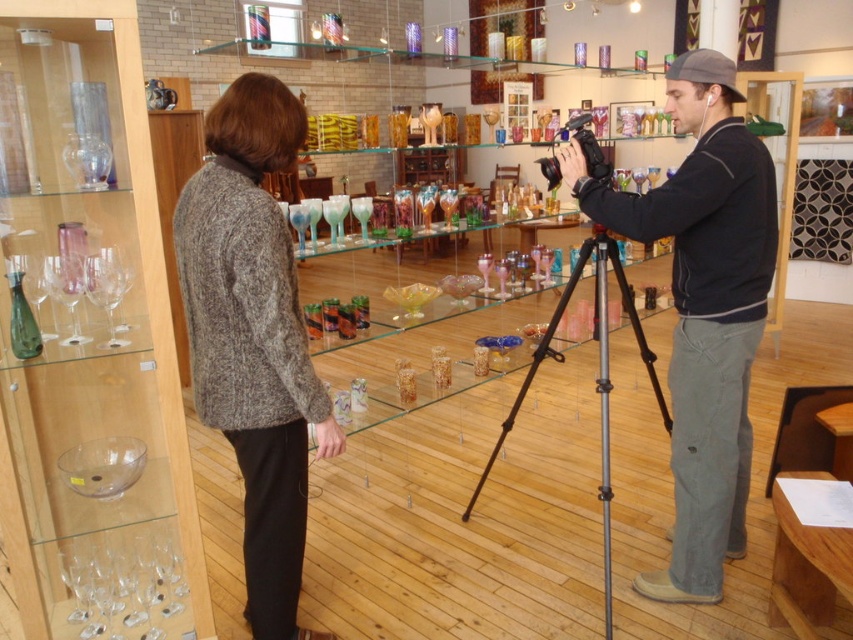
Question: Which object is the closest to the black plastic video camera at center?

Choices:
 (A) silver metallic tripod at center
 (B) clear glass vase at left

Answer: (A)

Question: Which of the following is the closest to the observer?

Choices:
 (A) clear glass vase at left
 (B) knitted sweater at center

Answer: (A)

Question: Can you confirm if knitted sweater at center is positioned above black plastic video camera at center?

Choices:
 (A) yes
 (B) no

Answer: (B)

Question: Considering the relative positions of dark gray sweatshirt at center and silver metallic tripod at center in the image provided, where is dark gray sweatshirt at center located with respect to silver metallic tripod at center?

Choices:
 (A) above
 (B) below

Answer: (A)

Question: Does clear glass vase at left appear under silver metallic tripod at center?

Choices:
 (A) no
 (B) yes

Answer: (A)

Question: Which point is closer to the camera taking this photo?

Choices:
 (A) (744, 196)
 (B) (114, 506)
 (C) (256, 621)
 (D) (611, 609)

Answer: (B)